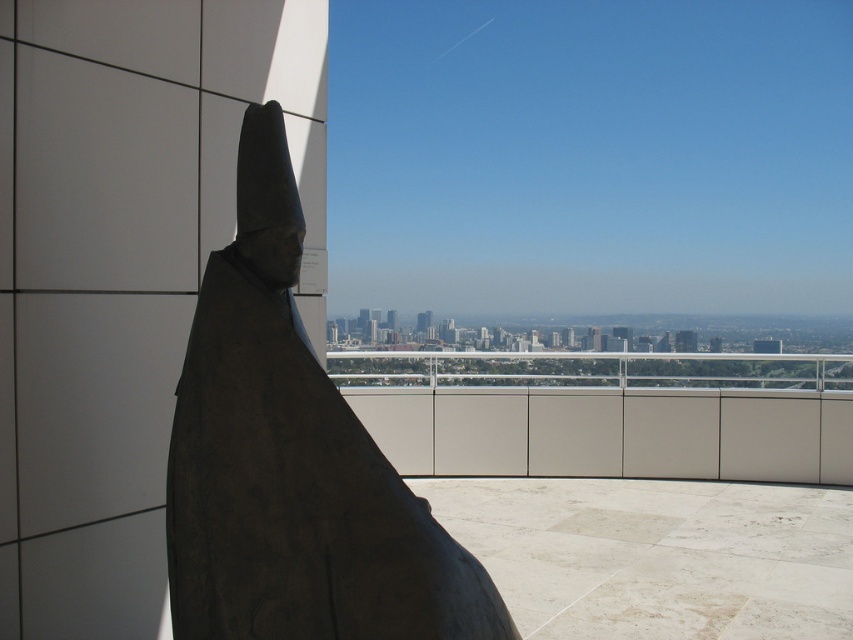
Question: Which point appears farthest from the camera in this image?

Choices:
 (A) (769, 387)
 (B) (213, 404)

Answer: (A)

Question: Observing the image, what is the correct spatial positioning of dark gray stone statue at left in reference to smooth concrete balcony at center?

Choices:
 (A) left
 (B) right

Answer: (A)

Question: Considering the relative positions of dark gray stone statue at left and smooth concrete balcony at center in the image provided, where is dark gray stone statue at left located with respect to smooth concrete balcony at center?

Choices:
 (A) below
 (B) above

Answer: (B)

Question: From the image, what is the correct spatial relationship of dark gray stone statue at left in relation to smooth concrete balcony at center?

Choices:
 (A) below
 (B) above

Answer: (B)

Question: Which of the following is the closest to the observer?

Choices:
 (A) (337, 637)
 (B) (809, 449)

Answer: (A)